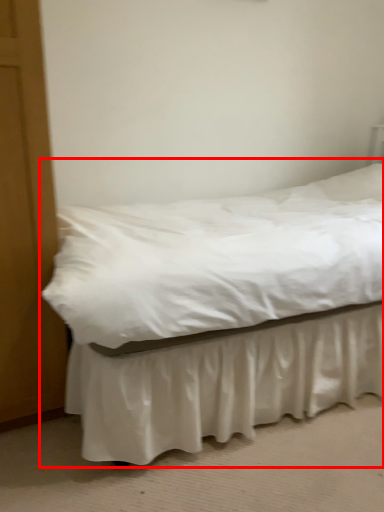
Question: From the image's perspective, what is the correct spatial positioning of bed (annotated by the red box) in reference to bed frame?

Choices:
 (A) below
 (B) above

Answer: (B)